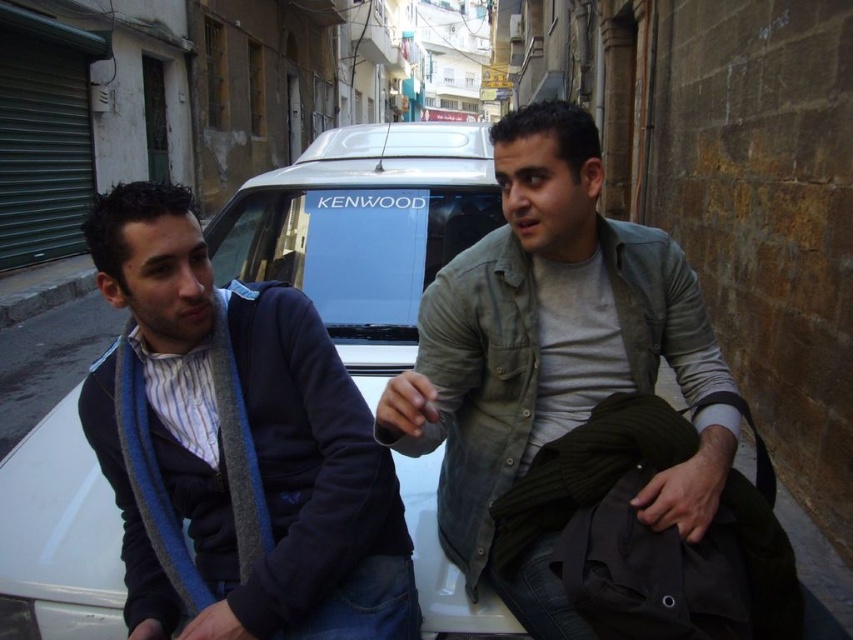
Does gray cotton shirt at center have a lesser width compared to white matte car at center?

Indeed, gray cotton shirt at center has a lesser width compared to white matte car at center.

In the scene shown: Does gray cotton shirt at center have a smaller size compared to white matte car at center?

Yes, gray cotton shirt at center is smaller than white matte car at center.

At what (x,y) coordinates should I click in order to perform the action: click on gray cotton shirt at center. Please return your answer as a coordinate pair (x, y). This screenshot has height=640, width=853. Looking at the image, I should click on (538, 344).